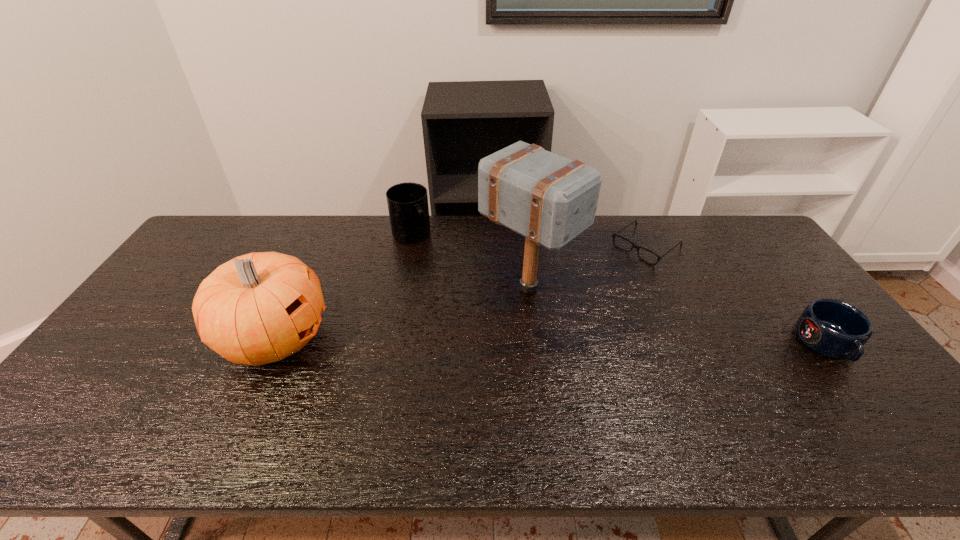
The height and width of the screenshot is (540, 960). In order to click on pumpkin in this screenshot , I will do `click(258, 308)`.

Where is `the second tallest object`? the second tallest object is located at coordinates (258, 308).

You are a GUI agent. You are given a task and a screenshot of the screen. Output one action in this format:
    pyautogui.click(x=<x>, y=<y>)
    Task: Click on the nearer mug
    The width and height of the screenshot is (960, 540).
    Given the screenshot: What is the action you would take?
    pyautogui.click(x=832, y=328)

Where is `the second shortest object`? This screenshot has width=960, height=540. the second shortest object is located at coordinates (832, 328).

Find the location of `mallet`. mallet is located at coordinates (550, 200).

This screenshot has height=540, width=960. I want to click on the tallest object, so click(550, 200).

The height and width of the screenshot is (540, 960). I want to click on the left mug, so click(x=407, y=202).

This screenshot has width=960, height=540. Find the location of `the fourth object from right to left`. the fourth object from right to left is located at coordinates (407, 202).

Identify the location of the shortest object. This screenshot has width=960, height=540. (614, 235).

Identify the location of the second object from right to left. The width and height of the screenshot is (960, 540). (614, 235).